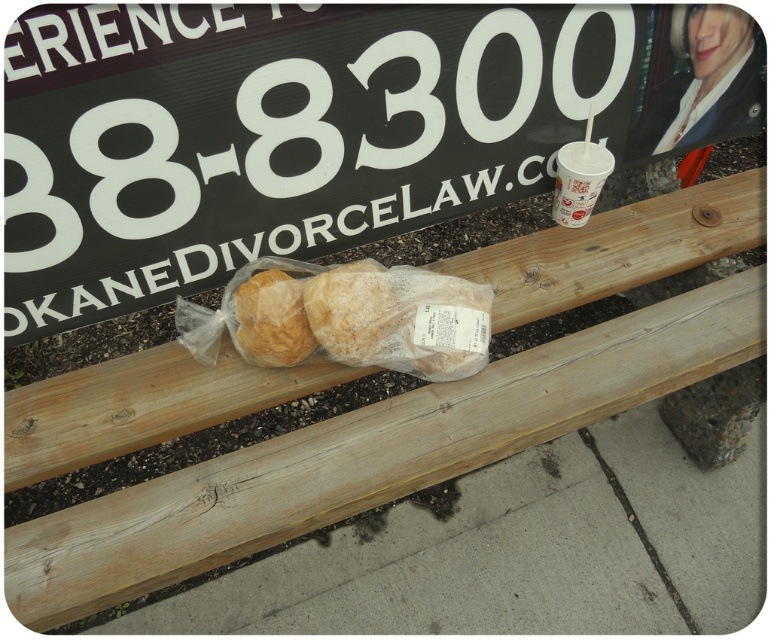
Which is behind, point (283, 284) or point (603, 182)?

The point (603, 182) is behind.

Is golden brown bread at center above white paper cup at upper right?

No.

Identify the location of golden brown bread at center. (271, 320).

Between translucent plastic baguette at center and golden brown bread at center, which one is positioned lower?

Positioned lower is golden brown bread at center.

Can you confirm if translucent plastic baguette at center is shorter than golden brown bread at center?

No, translucent plastic baguette at center is not shorter than golden brown bread at center.

Where is `translucent plastic baguette at center`? The image size is (771, 640). translucent plastic baguette at center is located at coordinates (362, 317).

Which is below, translucent plastic baguette at center or white paper cup at upper right?

translucent plastic baguette at center

Who is more forward, (x=480, y=365) or (x=584, y=180)?

Point (x=480, y=365)

You are a GUI agent. You are given a task and a screenshot of the screen. Output one action in this format:
    pyautogui.click(x=<x>, y=<y>)
    Task: Click on the translucent plastic baguette at center
    
    Given the screenshot: What is the action you would take?
    pyautogui.click(x=362, y=317)